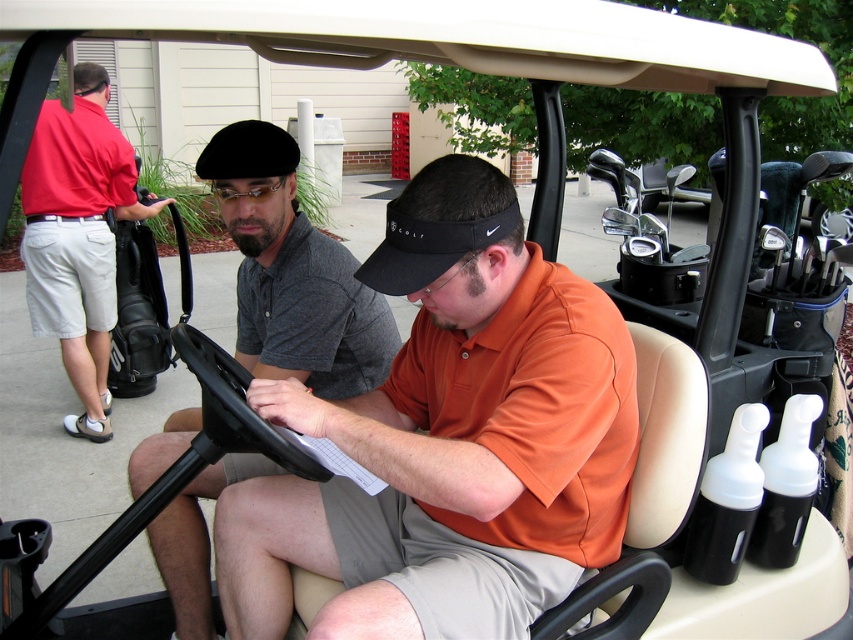
Question: Can you confirm if orange cotton shirt at center is positioned above red cotton polo shirt at left?

Choices:
 (A) no
 (B) yes

Answer: (A)

Question: Is orange cotton shirt at center positioned before red cotton polo shirt at left?

Choices:
 (A) yes
 (B) no

Answer: (A)

Question: Can you confirm if dark gray polo shirt at center is bigger than red cotton polo shirt at left?

Choices:
 (A) no
 (B) yes

Answer: (A)

Question: Which object is closer to the camera taking this photo?

Choices:
 (A) red cotton polo shirt at left
 (B) orange cotton shirt at center
 (C) dark gray polo shirt at center

Answer: (B)

Question: Which of the following is the farthest from the observer?

Choices:
 (A) red cotton polo shirt at left
 (B) dark gray polo shirt at center

Answer: (A)

Question: Among these objects, which one is farthest from the camera?

Choices:
 (A) dark gray polo shirt at center
 (B) red cotton polo shirt at left

Answer: (B)